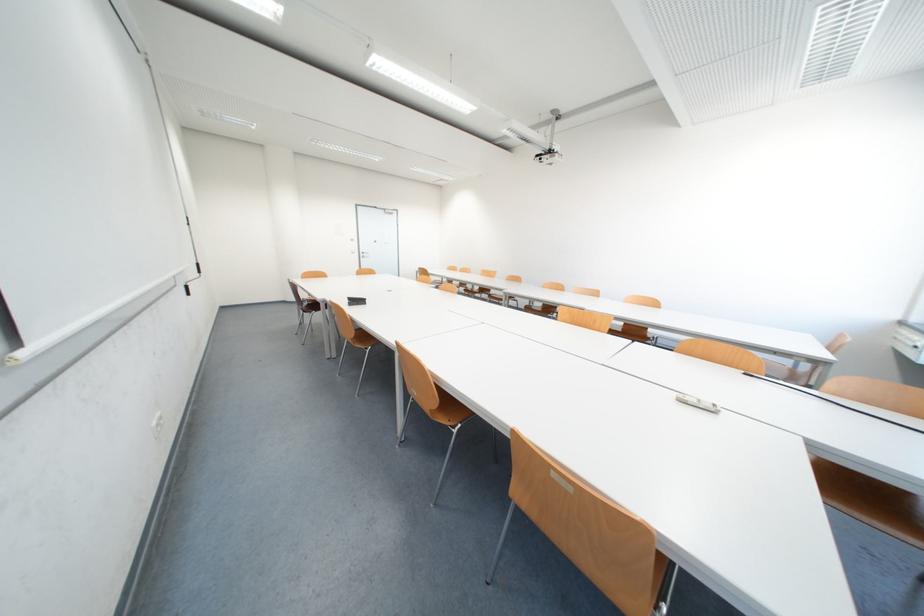
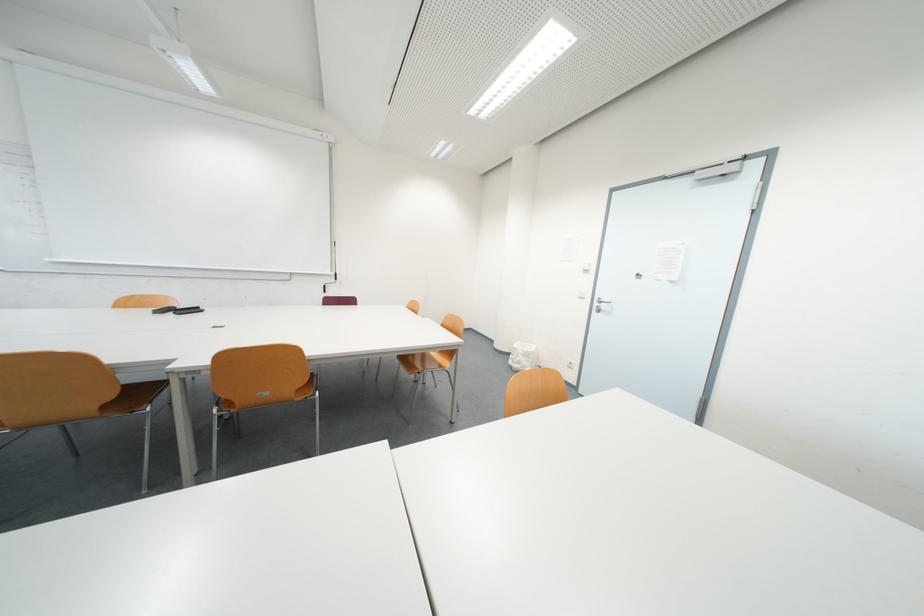
Find the pixel in the second image that matches point (371, 256) in the first image.

(605, 305)